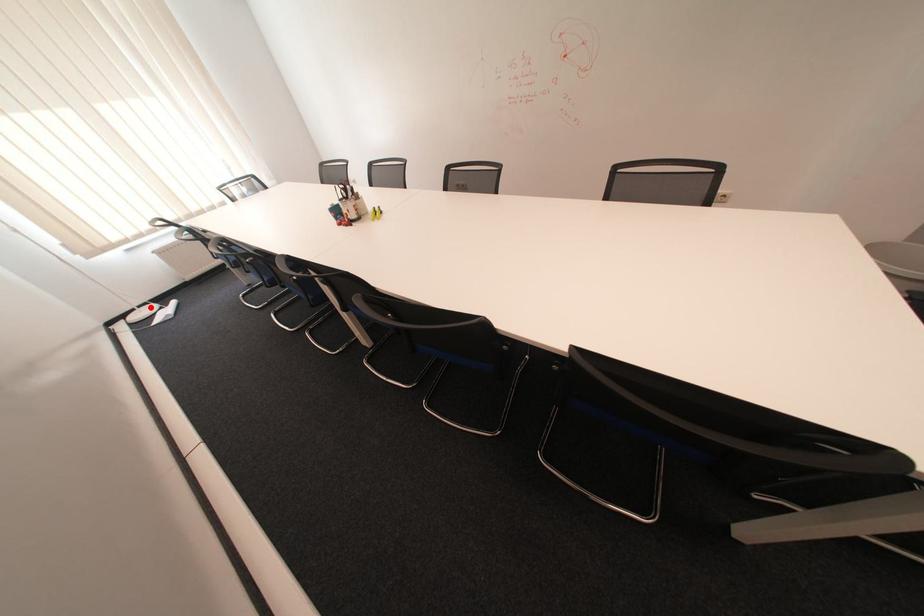
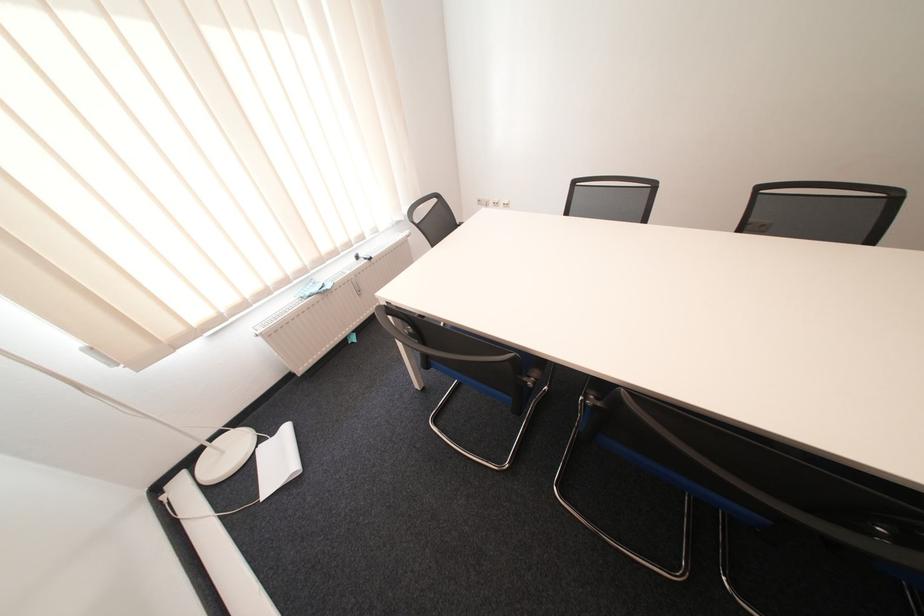
Where in the second image is the point corresponding to the highlighted location from the first image?

(225, 438)